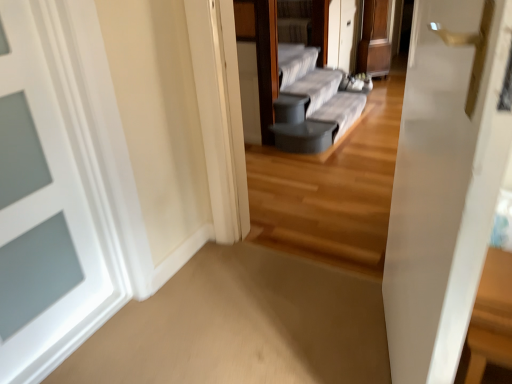
Question: Does wooden table at right have a lesser width compared to gray fabric couch at center?

Choices:
 (A) yes
 (B) no

Answer: (B)

Question: Would you say gray fabric couch at center is part of wooden table at right's contents?

Choices:
 (A) no
 (B) yes

Answer: (A)

Question: Is wooden table at right further to camera compared to gray fabric couch at center?

Choices:
 (A) no
 (B) yes

Answer: (A)

Question: Can you confirm if wooden table at right is positioned to the right of gray fabric couch at center?

Choices:
 (A) yes
 (B) no

Answer: (A)

Question: Is wooden table at right bigger than gray fabric couch at center?

Choices:
 (A) no
 (B) yes

Answer: (A)

Question: Considering the positions of wooden table at right and gray fabric couch at center in the image, is wooden table at right bigger or smaller than gray fabric couch at center?

Choices:
 (A) small
 (B) big

Answer: (A)

Question: In terms of height, does wooden table at right look taller or shorter compared to gray fabric couch at center?

Choices:
 (A) short
 (B) tall

Answer: (B)

Question: Is point (497, 309) closer or farther from the camera than point (320, 104)?

Choices:
 (A) closer
 (B) farther

Answer: (A)

Question: In terms of width, does wooden table at right look wider or thinner when compared to gray fabric couch at center?

Choices:
 (A) wide
 (B) thin

Answer: (A)

Question: From a real-world perspective, is gray fabric couch at center positioned above or below wooden table at right?

Choices:
 (A) below
 (B) above

Answer: (B)

Question: Is gray fabric couch at center to the left or to the right of wooden table at right in the image?

Choices:
 (A) right
 (B) left

Answer: (B)

Question: Based on their sizes in the image, would you say gray fabric couch at center is bigger or smaller than wooden table at right?

Choices:
 (A) big
 (B) small

Answer: (A)

Question: Is gray fabric couch at center situated inside wooden table at right or outside?

Choices:
 (A) inside
 (B) outside

Answer: (B)

Question: From a real-world perspective, relative to white painted wood door at left, is wooden table at right vertically above or below?

Choices:
 (A) above
 (B) below

Answer: (B)

Question: Choose the correct answer: Is wooden table at right inside white painted wood door at left or outside it?

Choices:
 (A) inside
 (B) outside

Answer: (B)